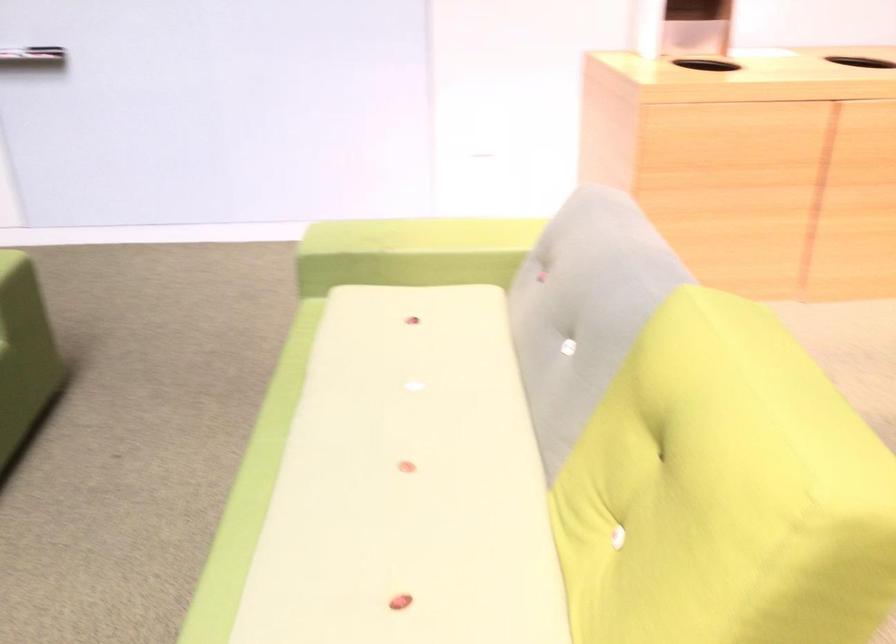
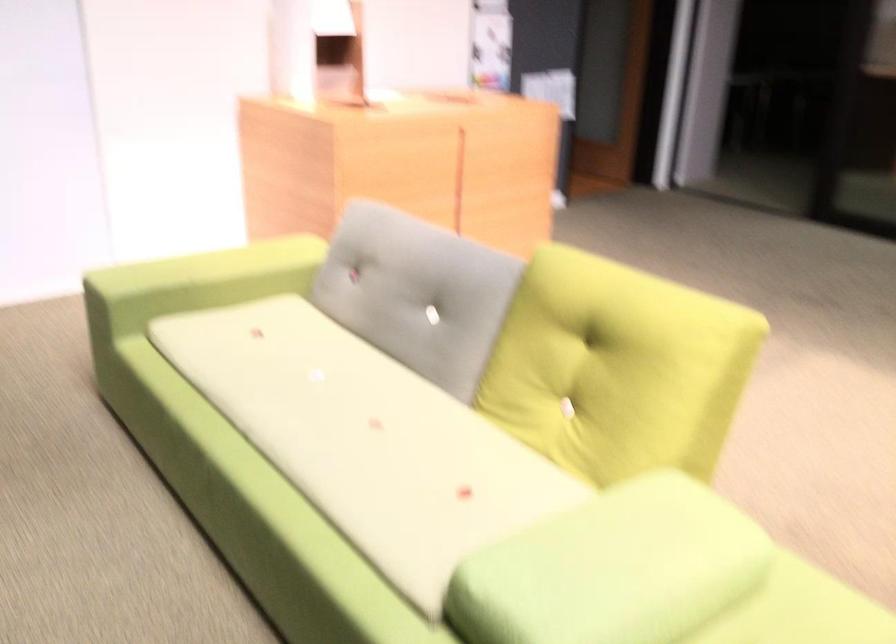
Locate, in the second image, the point that corresponds to [366,484] in the first image.

(366, 439)